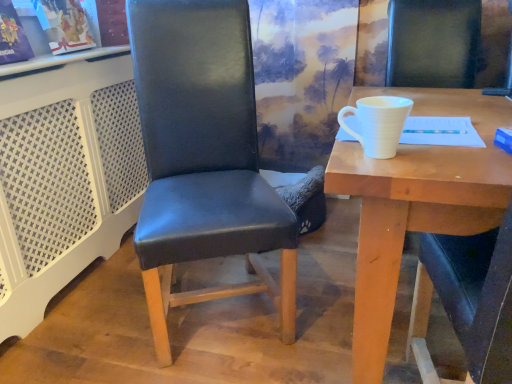
Question: From the image's perspective, is white matte cup at upper right beneath black leather chair at center?

Choices:
 (A) yes
 (B) no

Answer: (A)

Question: Is the surface of white matte cup at upper right in direct contact with black leather chair at center?

Choices:
 (A) yes
 (B) no

Answer: (B)

Question: Is white matte cup at upper right turned away from black leather chair at center?

Choices:
 (A) yes
 (B) no

Answer: (B)

Question: Considering the relative sizes of white matte cup at upper right and black leather chair at center in the image provided, is white matte cup at upper right wider than black leather chair at center?

Choices:
 (A) yes
 (B) no

Answer: (A)

Question: Is white matte cup at upper right facing towards black leather chair at center?

Choices:
 (A) no
 (B) yes

Answer: (A)

Question: Can you confirm if white matte cup at upper right is bigger than black leather chair at center?

Choices:
 (A) no
 (B) yes

Answer: (B)

Question: Is black leather chair at center not within white matte cup at upper right?

Choices:
 (A) yes
 (B) no

Answer: (A)

Question: Is black leather chair at center directly adjacent to white matte cup at upper right?

Choices:
 (A) yes
 (B) no

Answer: (B)

Question: Is black leather chair at center facing away from white matte cup at upper right?

Choices:
 (A) yes
 (B) no

Answer: (B)

Question: From a real-world perspective, is black leather chair at center below white matte cup at upper right?

Choices:
 (A) no
 (B) yes

Answer: (A)

Question: Does black leather chair at center have a greater height compared to white matte cup at upper right?

Choices:
 (A) no
 (B) yes

Answer: (B)

Question: Considering the relative sizes of black leather chair at center and white matte cup at upper right in the image provided, is black leather chair at center wider than white matte cup at upper right?

Choices:
 (A) yes
 (B) no

Answer: (B)

Question: Would you say white matte cup at right is part of white matte cup at upper right's contents?

Choices:
 (A) no
 (B) yes

Answer: (A)